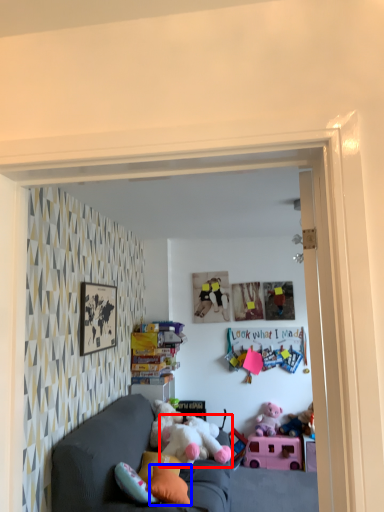
Question: Which point is further to the camera, toy (highlighted by a red box) or pillow (highlighted by a blue box)?

Choices:
 (A) toy
 (B) pillow

Answer: (A)